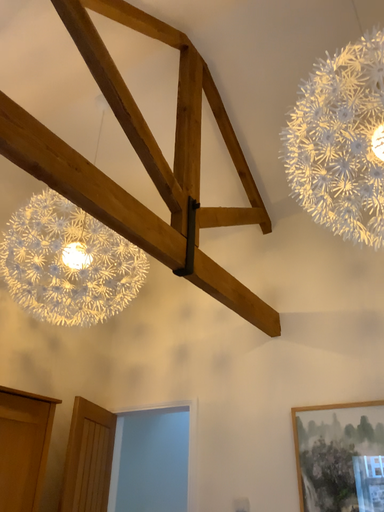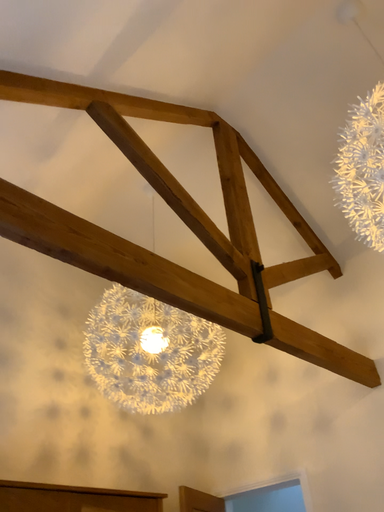
Question: Which way did the camera rotate in the video?

Choices:
 (A) rotated right
 (B) rotated left

Answer: (B)